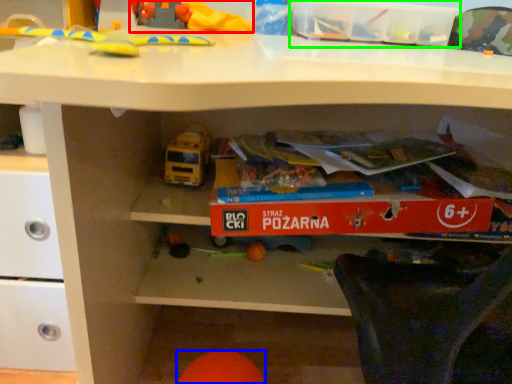
Question: Which is nearer to the toy (highlighted by a red box)? toy (highlighted by a blue box) or storage box (highlighted by a green box).

Choices:
 (A) toy
 (B) storage box

Answer: (B)